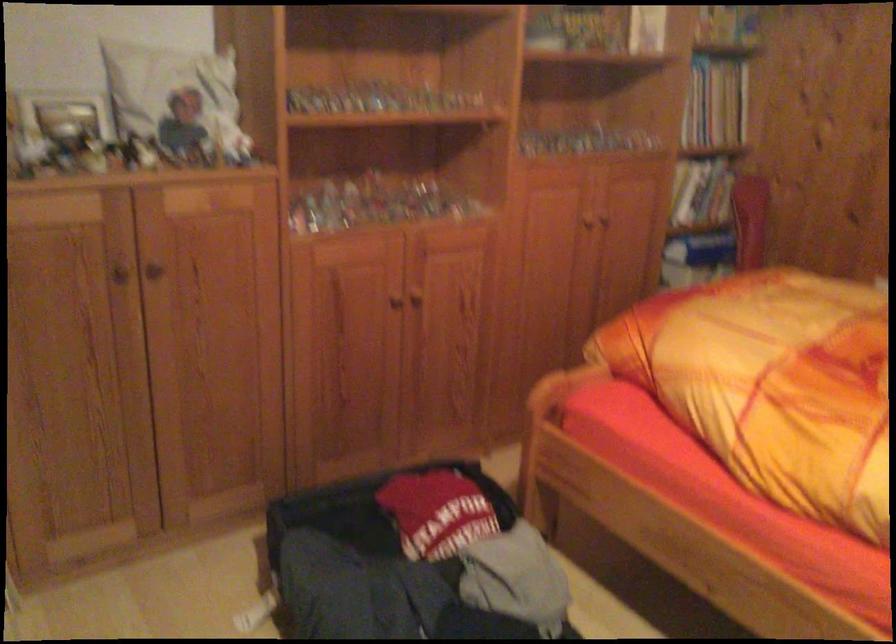
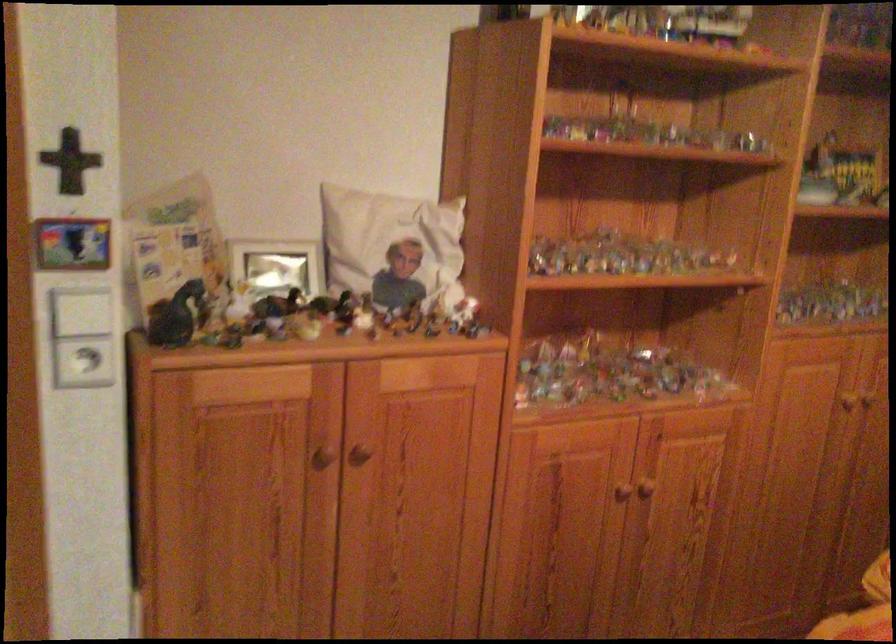
In a continuous first-person perspective shot, in which direction is the camera moving?

The cameraman walked toward left, forward.